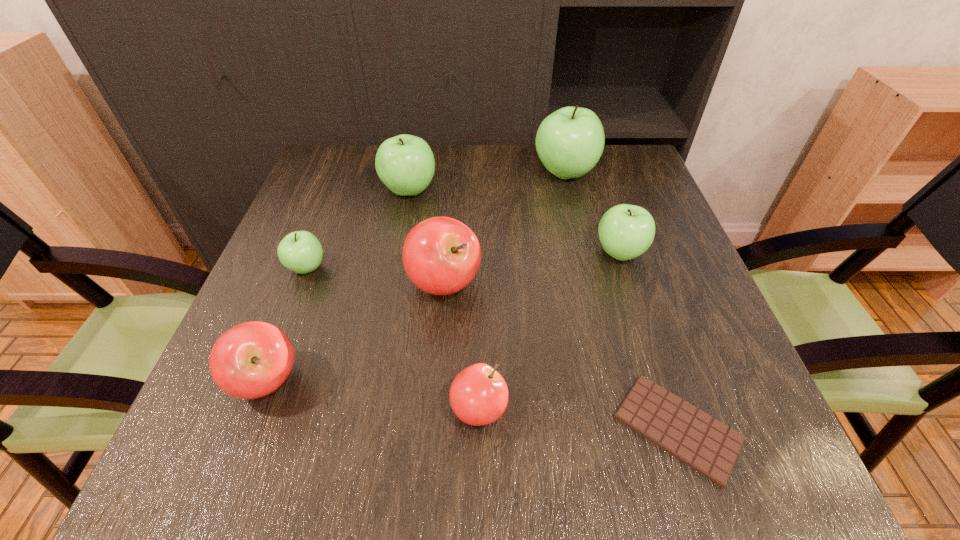
Find the location of a particular element. the biggest green apple is located at coordinates (570, 141).

Find the location of `the tallest apple`. the tallest apple is located at coordinates (570, 141).

This screenshot has width=960, height=540. Identify the location of the second biggest green apple. (405, 163).

In order to click on the farthest red apple in this screenshot , I will do `click(441, 255)`.

Locate an element on the screen. the second smallest green apple is located at coordinates (626, 231).

This screenshot has width=960, height=540. What are the coordinates of `the second smallest red apple` in the screenshot? It's located at (251, 360).

Locate an element on the screen. Image resolution: width=960 pixels, height=540 pixels. the leftmost green apple is located at coordinates (300, 251).

Identify the location of the smallest red apple. (478, 395).

At what (x,y) coordinates should I click in order to perform the action: click on brown chocolate bar. Please return your answer as a coordinate pair (x, y). The image size is (960, 540). Looking at the image, I should click on (708, 446).

You are a GUI agent. You are given a task and a screenshot of the screen. Output one action in this format:
    pyautogui.click(x=<x>, y=<y>)
    Task: Click on the chocolate bar
    
    Given the screenshot: What is the action you would take?
    pyautogui.click(x=708, y=446)